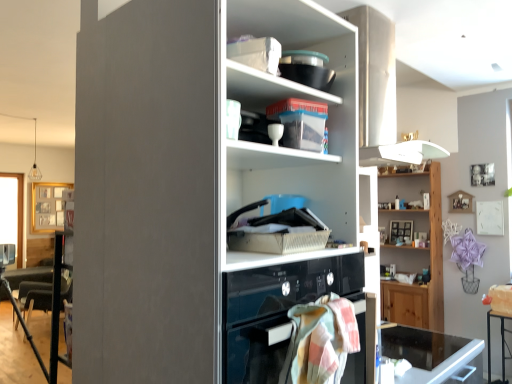
Question: Does wooden shelf at upper right, which is the 2th shelf in front-to-back order, have a smaller size compared to pastel plaid towel at lower center?

Choices:
 (A) yes
 (B) no

Answer: (B)

Question: Is wooden shelf at upper right, which is the second shelf from left to right, at the left side of pastel plaid towel at lower center?

Choices:
 (A) yes
 (B) no

Answer: (B)

Question: Is wooden shelf at upper right, acting as the second shelf starting from the top, located outside pastel plaid towel at lower center?

Choices:
 (A) no
 (B) yes

Answer: (B)

Question: Can you confirm if wooden shelf at upper right, marked as the 1th shelf in a right-to-left arrangement, is taller than pastel plaid towel at lower center?

Choices:
 (A) yes
 (B) no

Answer: (A)

Question: Could pastel plaid towel at lower center be considered to be inside wooden shelf at upper right, which is the 1th shelf in back-to-front order?

Choices:
 (A) yes
 (B) no

Answer: (B)

Question: Is wooden shelf at upper right, acting as the second shelf starting from the top, bigger than pastel plaid towel at lower center?

Choices:
 (A) yes
 (B) no

Answer: (A)

Question: Are wooden shelf at upper right, marked as the 1th shelf in a right-to-left arrangement, and white glossy cupboard at center far apart?

Choices:
 (A) no
 (B) yes

Answer: (B)

Question: Does wooden shelf at upper right, acting as the second shelf starting from the top, have a lesser width compared to white glossy cupboard at center?

Choices:
 (A) no
 (B) yes

Answer: (B)

Question: Is wooden shelf at upper right, which is the second shelf from left to right, further to the viewer compared to white glossy cupboard at center?

Choices:
 (A) yes
 (B) no

Answer: (A)

Question: Considering the relative sizes of wooden shelf at upper right, placed as the 1th shelf when sorted from bottom to top, and white glossy cupboard at center in the image provided, is wooden shelf at upper right, placed as the 1th shelf when sorted from bottom to top, smaller than white glossy cupboard at center?

Choices:
 (A) no
 (B) yes

Answer: (B)

Question: Does wooden shelf at upper right, placed as the 1th shelf when sorted from bottom to top, appear on the left side of white glossy cupboard at center?

Choices:
 (A) yes
 (B) no

Answer: (B)

Question: Is wooden shelf at upper right, marked as the 1th shelf in a right-to-left arrangement, completely or partially outside of white glossy cupboard at center?

Choices:
 (A) no
 (B) yes

Answer: (B)

Question: From a real-world perspective, does pastel plaid towel at lower center sit lower than translucent plastic container at upper center, the 2th shelf viewed from the back?

Choices:
 (A) yes
 (B) no

Answer: (A)